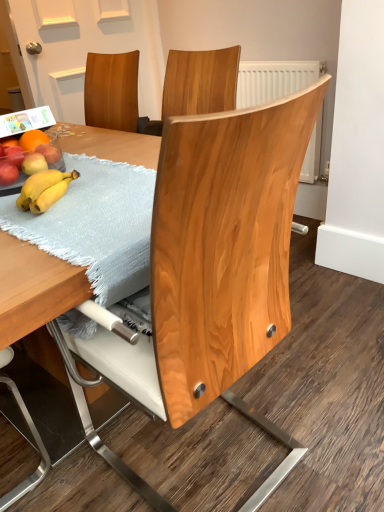
At what (x,y) coordinates should I click in order to perform the action: click on vacant area that is in front of matte red apple at left, marked as the first apple in a back-to-front arrangement. Please return your answer as a coordinate pair (x, y). The image size is (384, 512). Looking at the image, I should click on (62, 188).